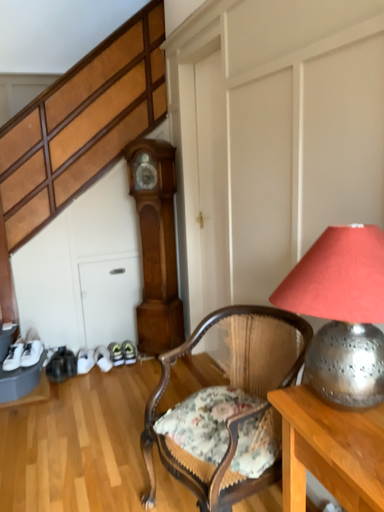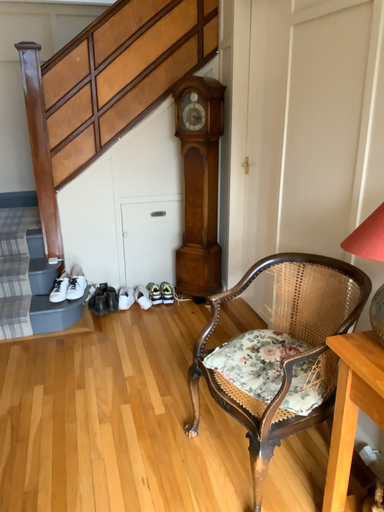
Question: Which way did the camera rotate in the video?

Choices:
 (A) rotated upward
 (B) rotated downward

Answer: (B)